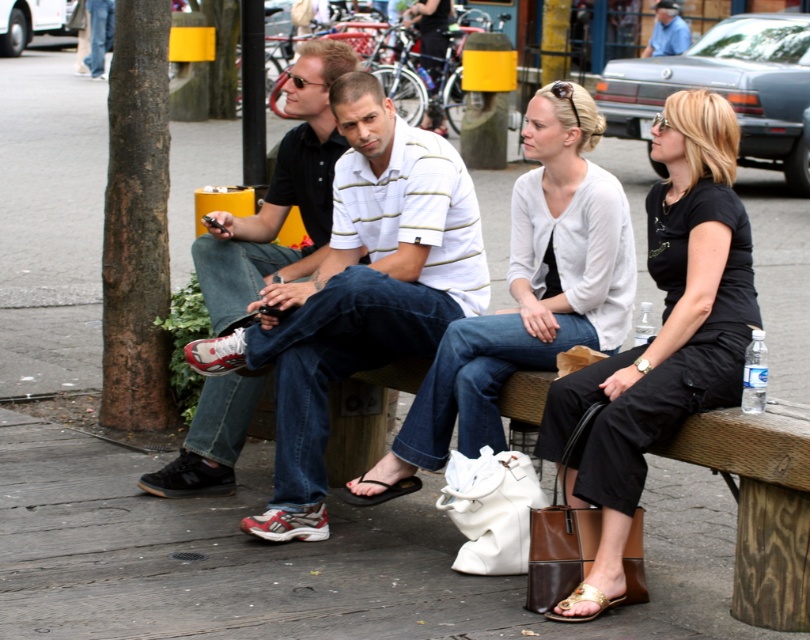
What is located at the coordinates point (x=531, y=289)?

The point (x=531, y=289) has a matte white sweater at center.

Consider the image. You are standing in front of the wooden bench where the four people are sitting. You notice two points marked on the bench. One is at point coordinates (608, 186) and the other at (301, 150). Which of these two points is closer to you?

Point (608, 186) is closer to you than point (301, 150).